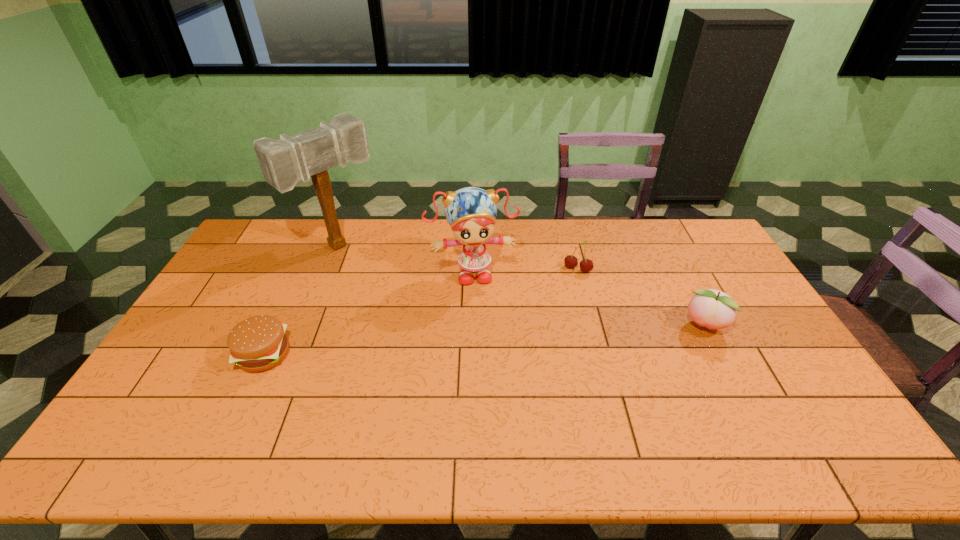
Identify the location of blank region between the doll and the hamburger. The width and height of the screenshot is (960, 540). (369, 313).

Locate an element on the screen. vacant area that lies between the third object from left to right and the rightmost object is located at coordinates (588, 299).

Where is `vacant point located between the hamburger and the tallest object`? Image resolution: width=960 pixels, height=540 pixels. vacant point located between the hamburger and the tallest object is located at coordinates (302, 300).

The image size is (960, 540). Identify the location of vacant space that is in between the tallest object and the hamburger. (302, 300).

Locate an element on the screen. This screenshot has width=960, height=540. free space between the tallest object and the shortest object is located at coordinates click(302, 300).

In order to click on free spot between the shortest object and the third object from left to right in this screenshot , I will do `click(369, 313)`.

Find the location of `object that is the second nearest to the peach`. object that is the second nearest to the peach is located at coordinates (471, 212).

The image size is (960, 540). What are the coordinates of `object that is the third closest to the tallest object` in the screenshot? It's located at (586, 265).

This screenshot has width=960, height=540. I want to click on vacant area in the image that satisfies the following two spatial constraints: 1. on the front side of the rightmost object; 2. on the right side of the cherry, so click(592, 326).

What are the coordinates of `vacant area that satisfies the following two spatial constraints: 1. on the front side of the peach; 2. on the left side of the cherry` in the screenshot? It's located at (592, 326).